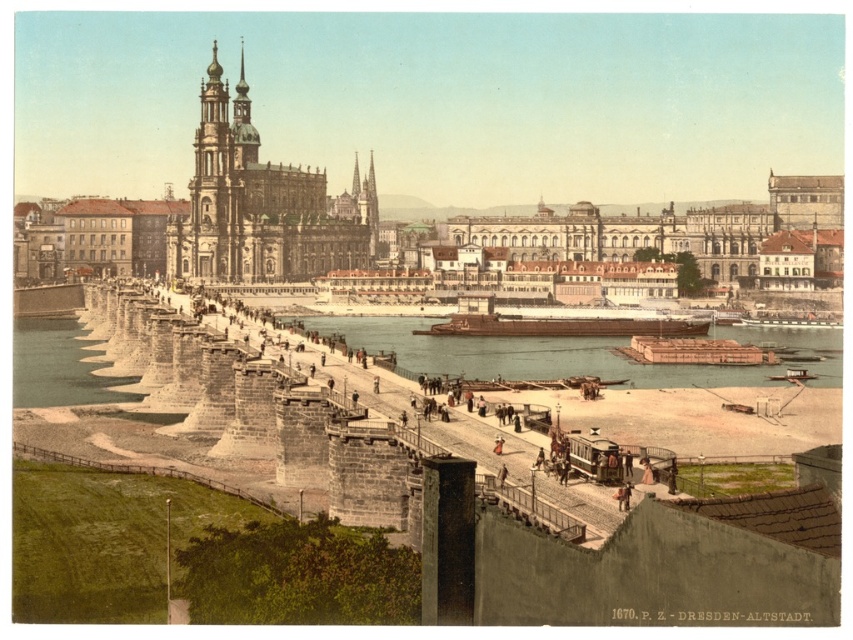
Question: Which object is closer to the camera taking this photo?

Choices:
 (A) brown wooden boats at center
 (B) golden ornate tower at upper left
 (C) brown matte barge at center

Answer: (A)

Question: In this image, where is brown wooden boats at center located relative to brown wooden raft at lower right?

Choices:
 (A) above
 (B) below

Answer: (A)

Question: Among these points, which one is nearest to the camera?

Choices:
 (A) (289, 221)
 (B) (560, 333)
 (C) (729, 349)
 (D) (434, 353)

Answer: (C)

Question: Considering the relative positions of brown wooden boats at center and brown wooden raft at lower right in the image provided, where is brown wooden boats at center located with respect to brown wooden raft at lower right?

Choices:
 (A) above
 (B) below

Answer: (A)

Question: Which object appears farthest from the camera in this image?

Choices:
 (A) brown wooden raft at lower right
 (B) brown matte barge at center
 (C) golden ornate tower at upper left
 (D) brown wooden boats at center

Answer: (C)

Question: Is brown wooden boats at center smaller than brown wooden raft at lower right?

Choices:
 (A) yes
 (B) no

Answer: (B)